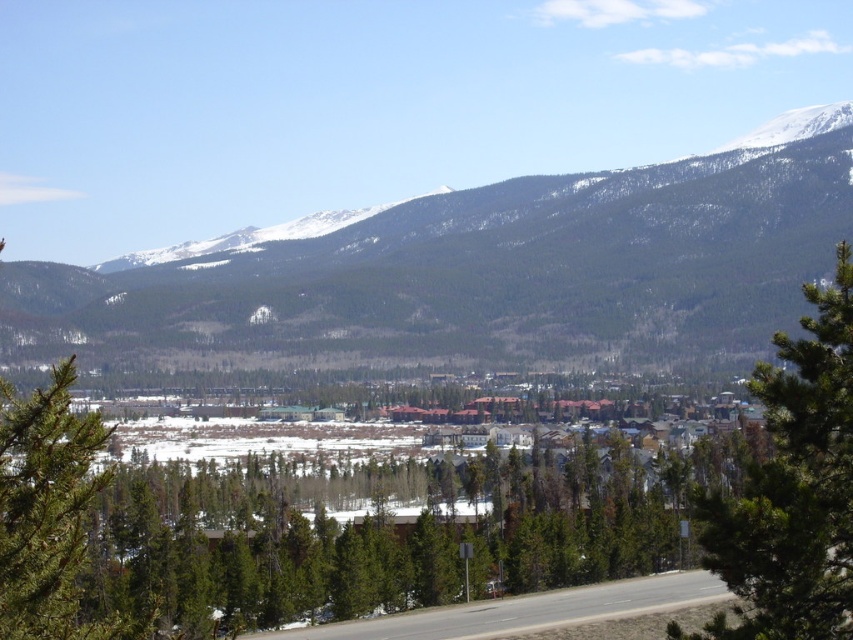
Question: Is snowy forested mountain at upper center below gray asphalt road at center?

Choices:
 (A) no
 (B) yes

Answer: (A)

Question: Is snowy forested mountain at upper center smaller than gray asphalt road at center?

Choices:
 (A) yes
 (B) no

Answer: (B)

Question: Based on their relative distances, which object is farther from the green textured tree at center-right?

Choices:
 (A) gray asphalt road at center
 (B) snowy forested mountain at upper center

Answer: (B)

Question: Does snowy forested mountain at upper center have a greater width compared to gray asphalt road at center?

Choices:
 (A) no
 (B) yes

Answer: (B)

Question: Which point is farther to the camera?

Choices:
 (A) (640, 225)
 (B) (633, 604)

Answer: (A)

Question: Which object is the farthest from the green textured tree at center-right?

Choices:
 (A) gray asphalt road at center
 (B) snowy forested mountain at upper center

Answer: (B)